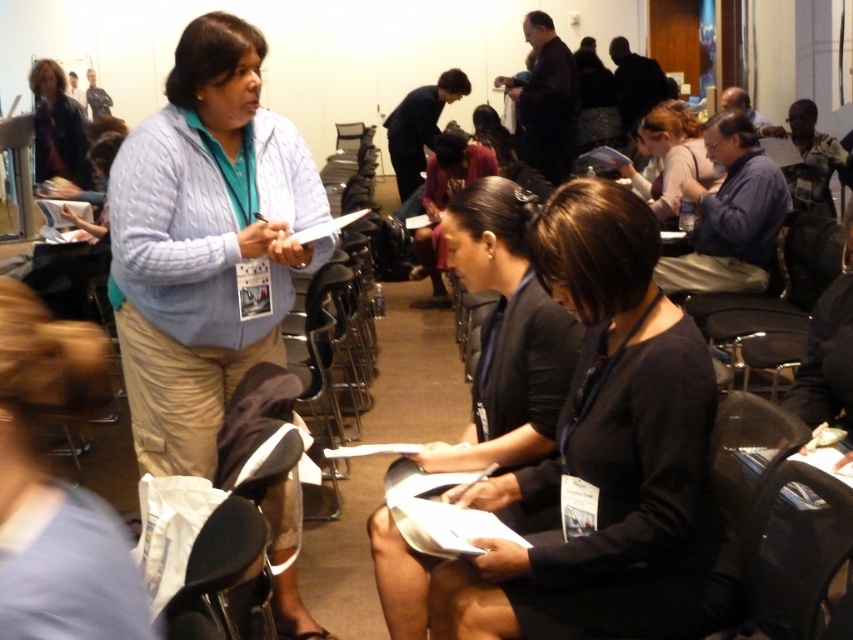
At what (x,y) coordinates should I click in order to perform the action: click on light blue knitted sweater at center. Please return your answer as a coordinate pair (x, y). The image size is (853, 640). Looking at the image, I should click on (206, 243).

Which is more to the right, light blue knitted sweater at center or matte black jacket at upper left?

light blue knitted sweater at center

Locate an element on the screen. The image size is (853, 640). light blue knitted sweater at center is located at coordinates (206, 243).

Between black fabric jacket at center and matte black hair at upper right, which one is positioned lower?

black fabric jacket at center is below.

You are a GUI agent. You are given a task and a screenshot of the screen. Output one action in this format:
    pyautogui.click(x=<x>, y=<y>)
    Task: Click on the black fabric jacket at center
    The height and width of the screenshot is (640, 853).
    Given the screenshot: What is the action you would take?
    pyautogui.click(x=506, y=333)

Measure the distance between black fabric shirt at center and camera.

black fabric shirt at center and camera are 5.00 feet apart from each other.

Is black fabric shirt at center taller than light blue knitted sweater at center?

Incorrect, black fabric shirt at center's height is not larger of light blue knitted sweater at center's.

Find the location of `black fabric shirt at center`. black fabric shirt at center is located at coordinates (602, 456).

Find the location of a particular element. The width and height of the screenshot is (853, 640). black fabric shirt at center is located at coordinates (602, 456).